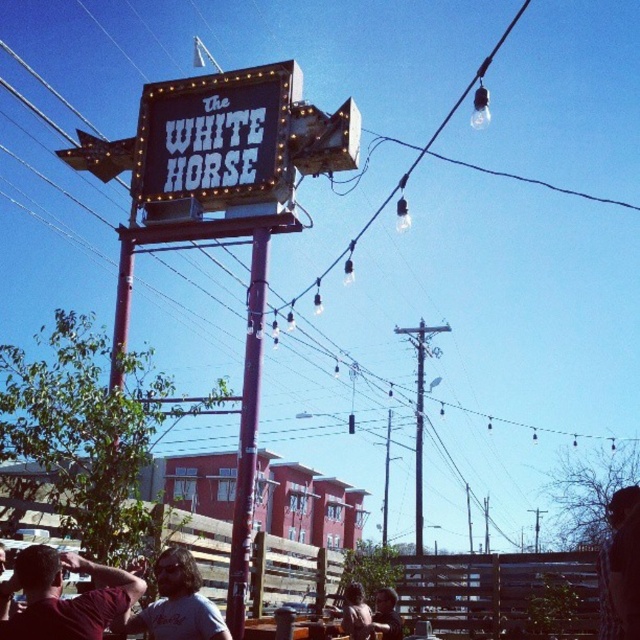
Question: Can you confirm if brown leather jacket at lower center is wider than dark brown leather jacket at lower center?

Choices:
 (A) no
 (B) yes

Answer: (A)

Question: Which object appears closest to the camera in this image?

Choices:
 (A) black illuminated sign at upper center
 (B) dark brown leather jacket at lower center
 (C) maroon shirt at lower left
 (D) gray cotton t-shirt at lower left

Answer: (C)

Question: In this image, where is maroon shirt at lower left located relative to dark brown leather jacket at lower center?

Choices:
 (A) right
 (B) left

Answer: (B)

Question: Which is nearer to the brown leather jacket at lower center?

Choices:
 (A) maroon shirt at lower left
 (B) metallic pole at center

Answer: (B)

Question: Can you confirm if gray cotton t-shirt at lower left is thinner than brown leather jacket at lower center?

Choices:
 (A) yes
 (B) no

Answer: (B)

Question: Which of the following is the farthest from the observer?

Choices:
 (A) (109, 600)
 (B) (396, 612)
 (C) (195, 99)
 (D) (237, 531)

Answer: (B)